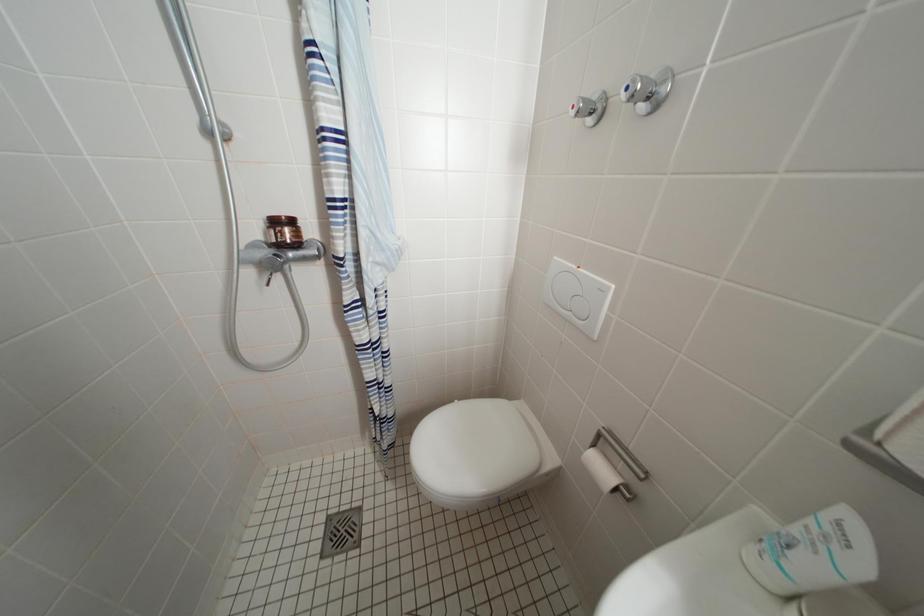
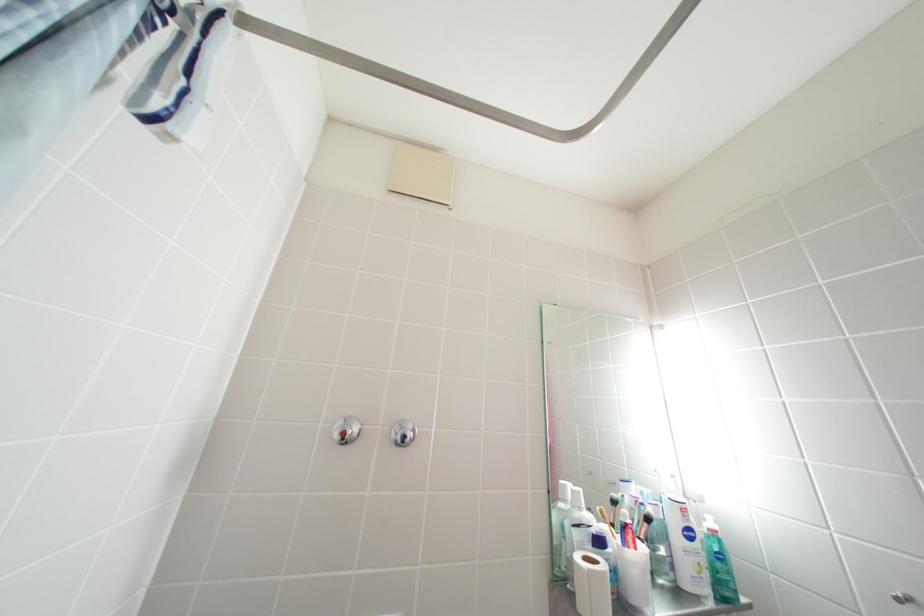
The images are taken continuously from a first-person perspective. In which direction is your viewpoint rotating?

The rotation direction of the camera is right-up.